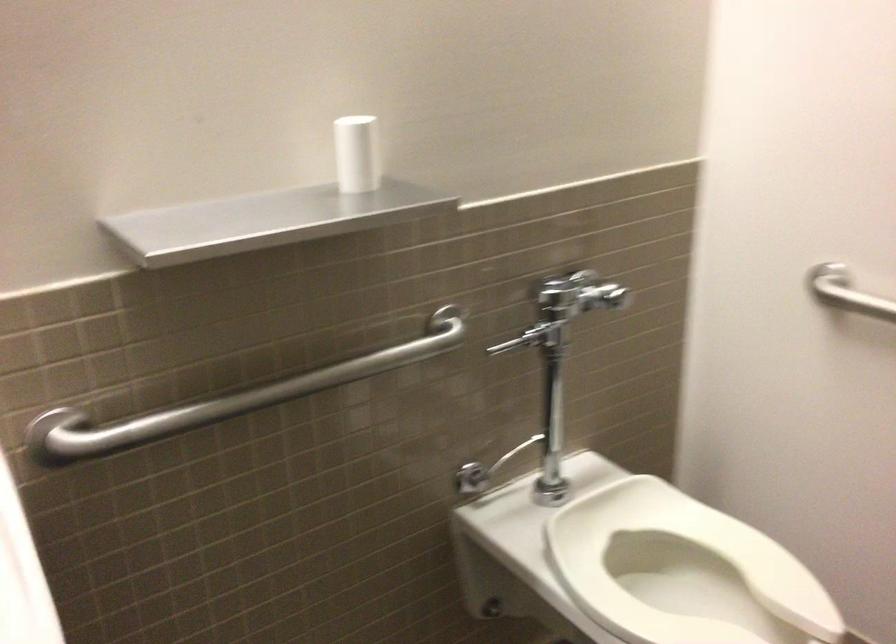
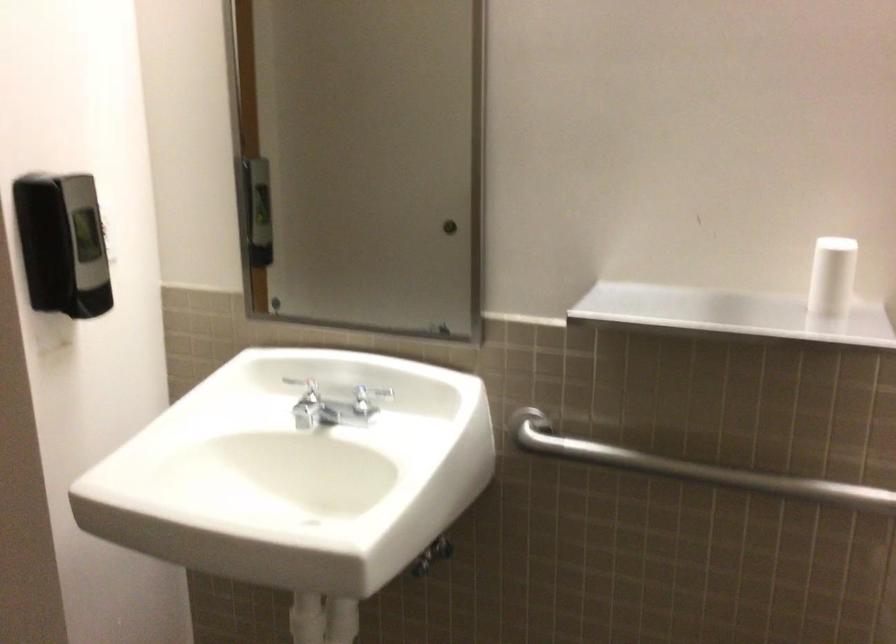
The point at (x=378, y=164) is marked in the first image. Where is the corresponding point in the second image?

(831, 277)